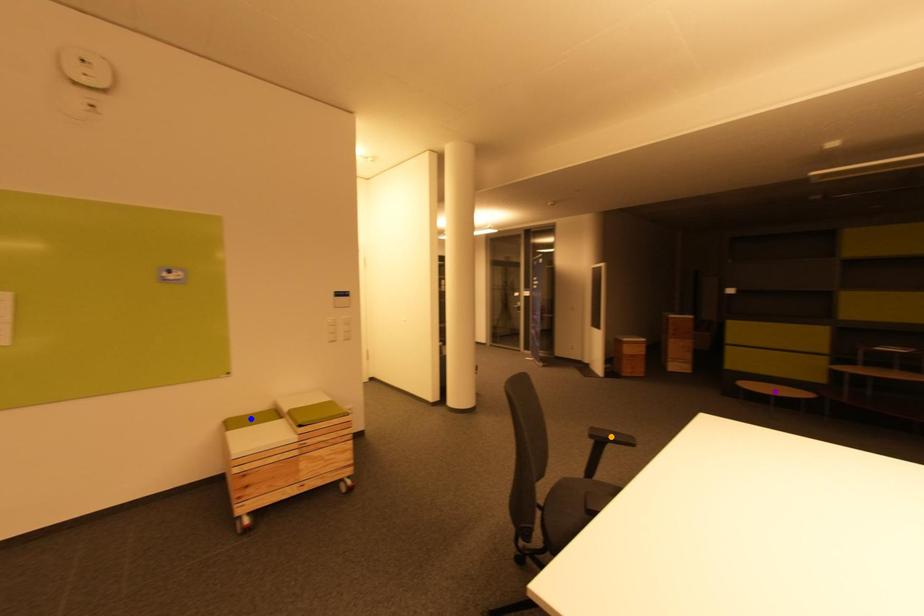
Order these from farthest to nearest:
- blue point
- orange point
- purple point

purple point → blue point → orange point